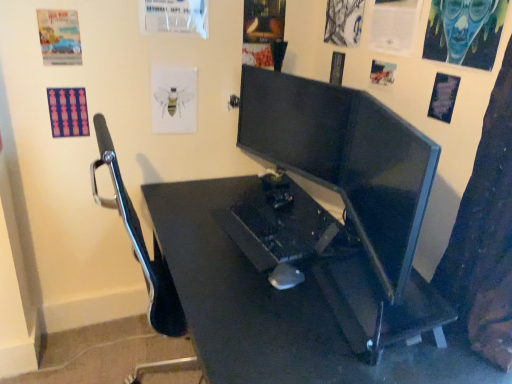
Question: From the image's perspective, is pink fabric poster at upper left, the ninth poster page when ordered from right to left, above or below matte paper poster at upper right, the fourth poster page when ordered from right to left?

Choices:
 (A) above
 (B) below

Answer: (B)

Question: Based on their positions, is pink fabric poster at upper left, the 1th poster page when ordered from left to right, located to the left or right of matte paper poster at upper right, arranged as the 6th poster page when viewed from the left?

Choices:
 (A) left
 (B) right

Answer: (A)

Question: Which object is the closest to the matte black monitor at center, the 1th computer monitor in the front-to-back sequence?

Choices:
 (A) blue painted canvas at upper right, placed as the ninth poster page when sorted from left to right
 (B) blue paper poster at upper right, which appears as the second poster page when viewed from the right
 (C) black plastic mouse at center
 (D) white paper at upper center, acting as the 4th poster page starting from the left
 (E) matte black monitor at center, acting as the 2th computer monitor starting from the front

Answer: (E)

Question: Which object is positioned closest to the matte paper poster at upper left, the second poster page viewed from the left?

Choices:
 (A) matte paper poster at upper right, arranged as the 6th poster page when viewed from the left
 (B) charcoal sketch at upper right, the 5th poster page from the right
 (C) white paper at upper right, the 3th poster page from the right
 (D) white paper at upper center, the sixth poster page in the right-to-left sequence
 (E) white paper bee at upper center, the 3th poster page from the left

Answer: (D)